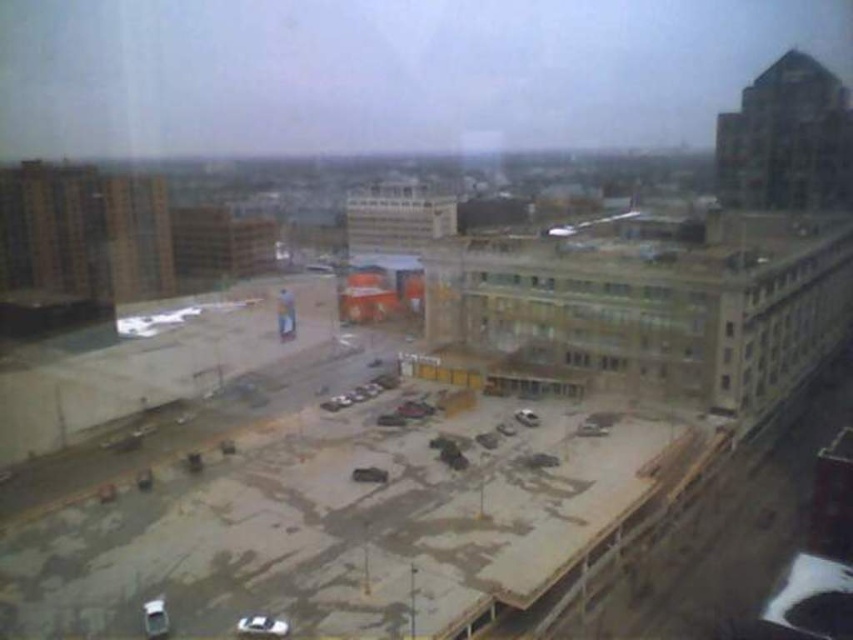
Is silver metallic car at lower center to the left of white matte car at lower left from the viewer's perspective?

Incorrect, silver metallic car at lower center is not on the left side of white matte car at lower left.

Between silver metallic car at lower center and white matte car at lower left, which one has more height?

With more height is silver metallic car at lower center.

Identify the location of silver metallic car at lower center. The height and width of the screenshot is (640, 853). click(262, 625).